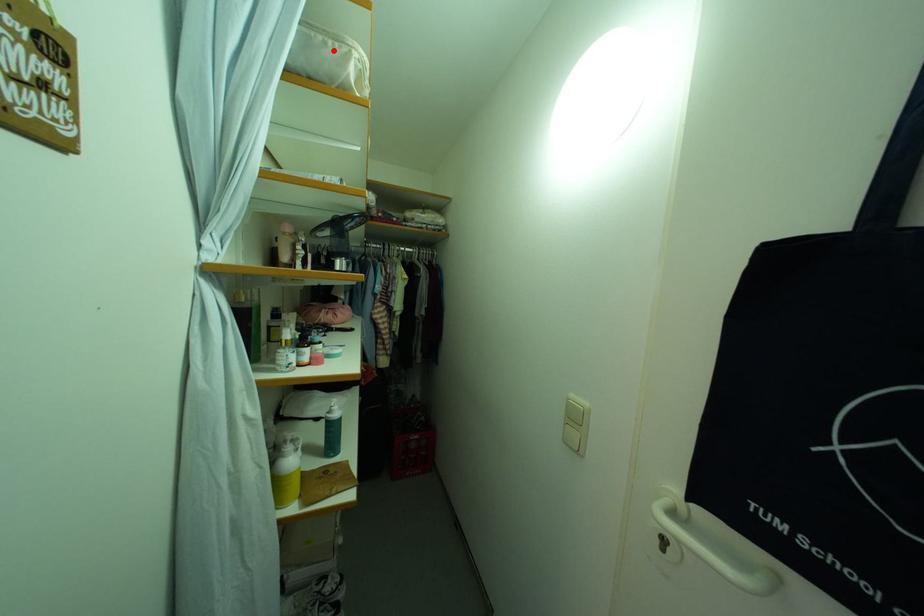
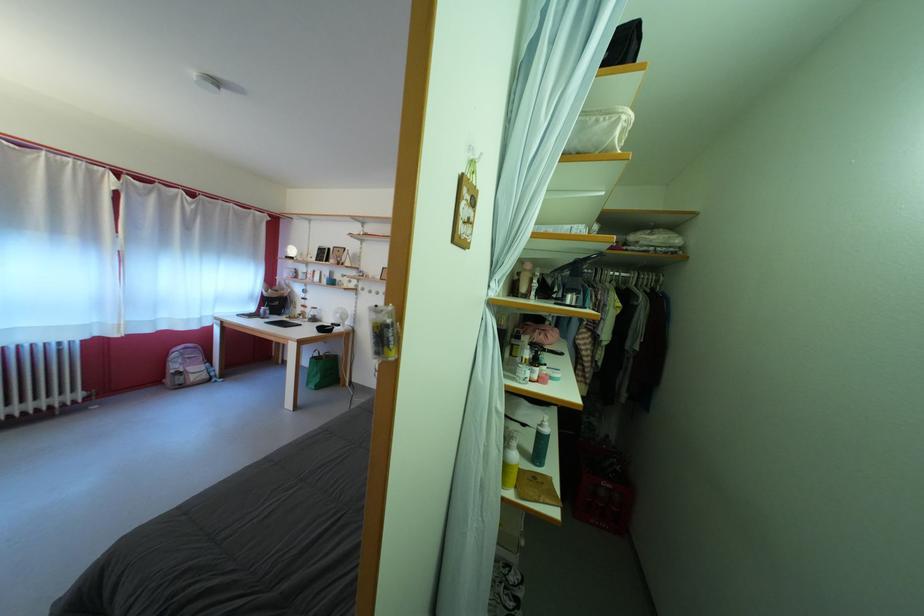
The point at the highlighted location is marked in the first image. Where is the corresponding point in the second image?

(605, 128)